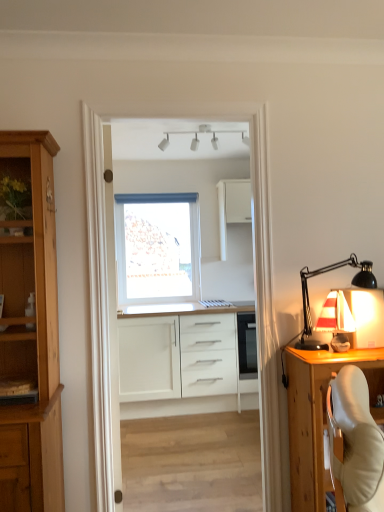
In order to click on free point above white matte window at center (from a real-world perspective) in this screenshot , I will do `click(168, 189)`.